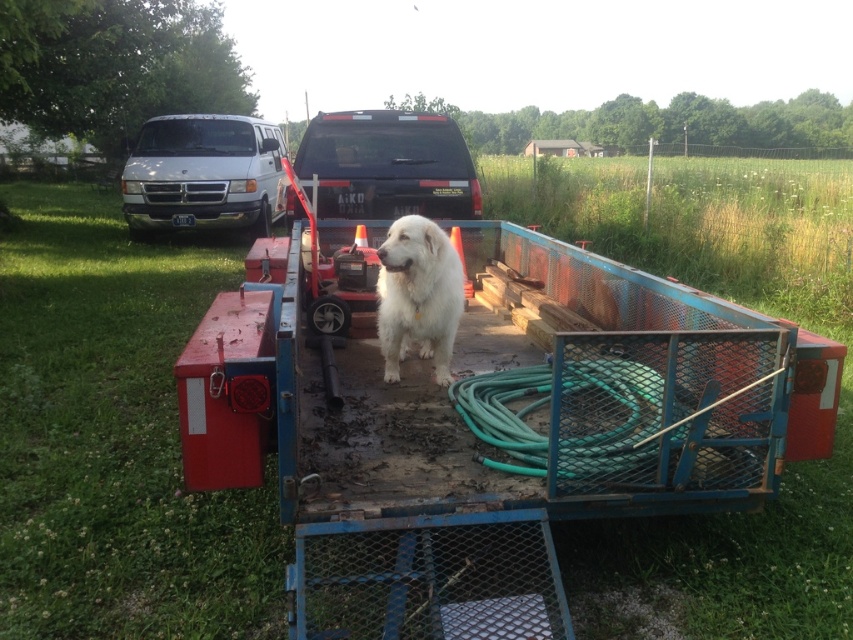
Based on the photo, you are driving a car and want to take a photo of the white fluffy dog at center without getting too close to the white matte van at upper left. What is the minimum distance you need to maintain between your car and the van to safely capture the dog in the frame?

The minimum distance you need to maintain between your car and the white matte van at upper left is 7.58 meters to ensure the white fluffy dog at center is within the frame while keeping a safe distance from the van.

You are a delivery person trying to load a package onto the trailer. The package is 22 inches long and needs to be placed between the green rubber garden hose at center and the white fluffy dog at center. Is there enough space for the package?

The distance between the green rubber garden hose at center and the white fluffy dog at center is 21.91 inches. Since the package is 22 inches long, there is not enough space to place it between them.

You are a delivery driver who needs to load a 2.5 meters tall package onto the matte black truck at center. The green rubber garden hose at center is currently blocking the loading area. Can you lift the hose to make space?

The matte black truck at center is taller than the green rubber garden hose at center, so yes, you can lift the green rubber garden hose at center to make space since it is shorter than the truck.